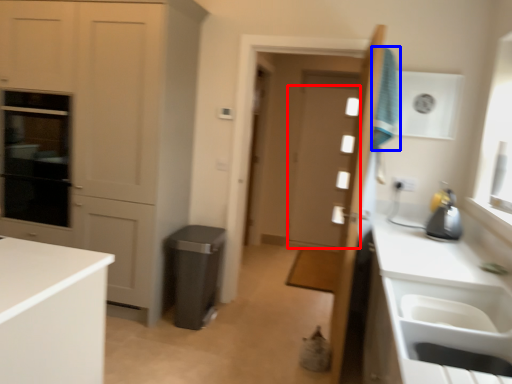
Question: Which point is further to the camera, door (highlighted by a red box) or laundry (highlighted by a blue box)?

Choices:
 (A) door
 (B) laundry

Answer: (A)